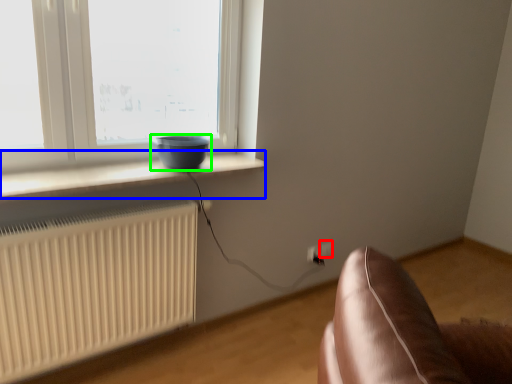
Question: Which is nearer to the electric outlet (highlighted by a red box)? window sill (highlighted by a blue box) or bowl (highlighted by a green box).

Choices:
 (A) window sill
 (B) bowl

Answer: (B)